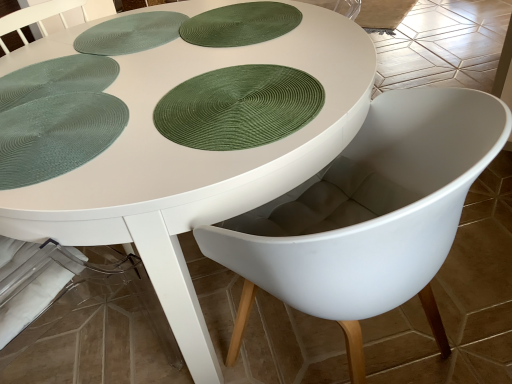
The height and width of the screenshot is (384, 512). Find the location of `empty space that is ontop of green woven placemat at center, which is counted as the second paper plate, starting from the bottom`. empty space that is ontop of green woven placemat at center, which is counted as the second paper plate, starting from the bottom is located at coordinates (229, 103).